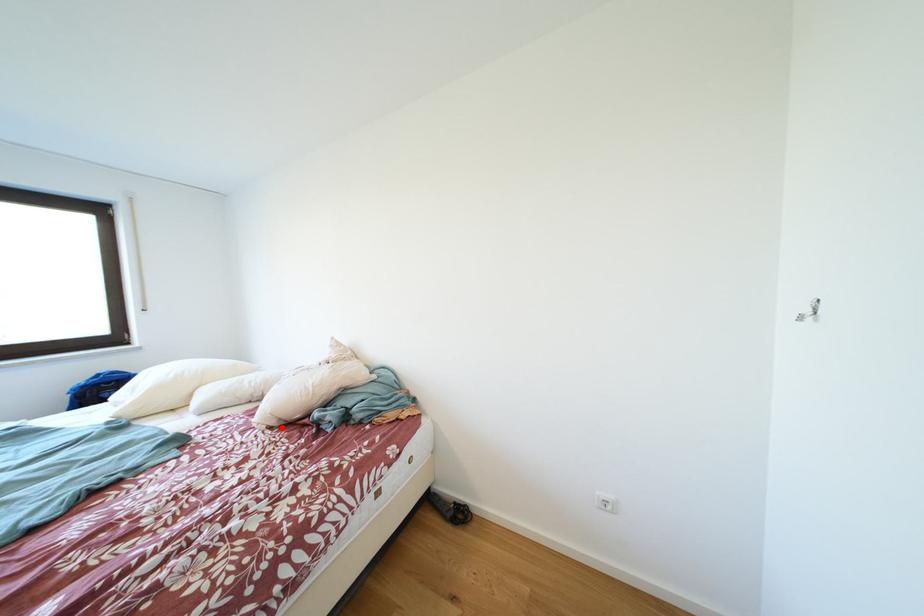
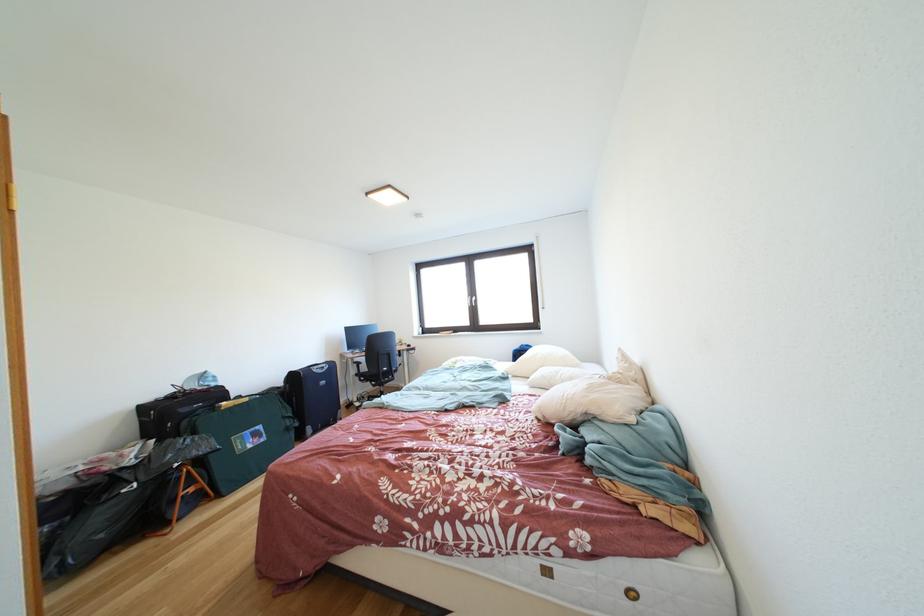
Question: I am providing you with two images of the same scene from different viewpoints. Given a red point in image1, look at the same physical point in image2. Is it:

Choices:
 (A) Closer to the viewpoint
 (B) Farther from the viewpoint

Answer: (A)